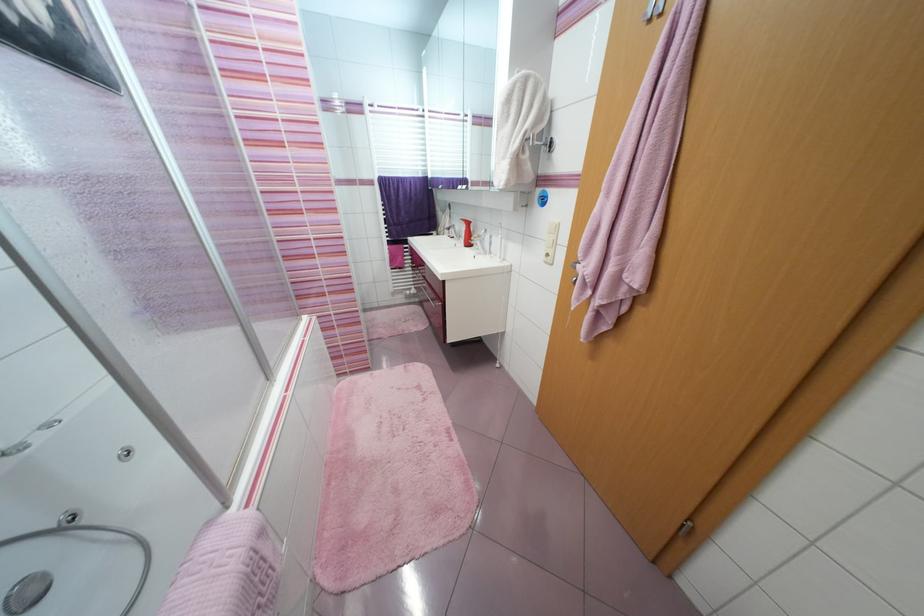
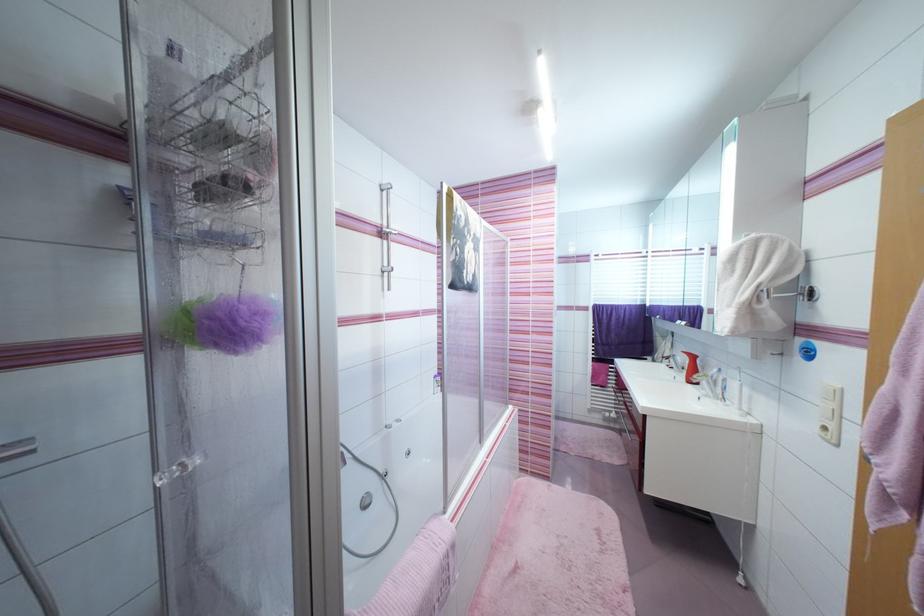
Find the pixel in the second image that matches pixel 483 254 in the first image.

(711, 398)